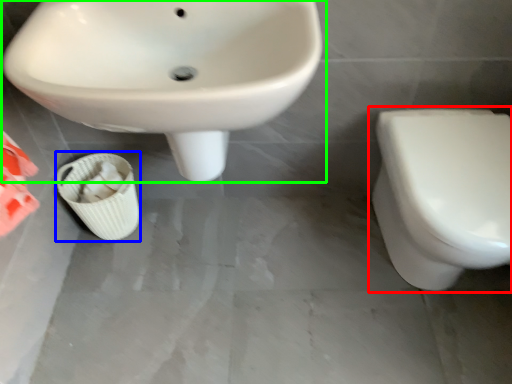
Question: Which object is the farthest from toilet (highlighted by a red box)? Choose among these: potty (highlighted by a blue box) or sink (highlighted by a green box).

Choices:
 (A) potty
 (B) sink

Answer: (A)